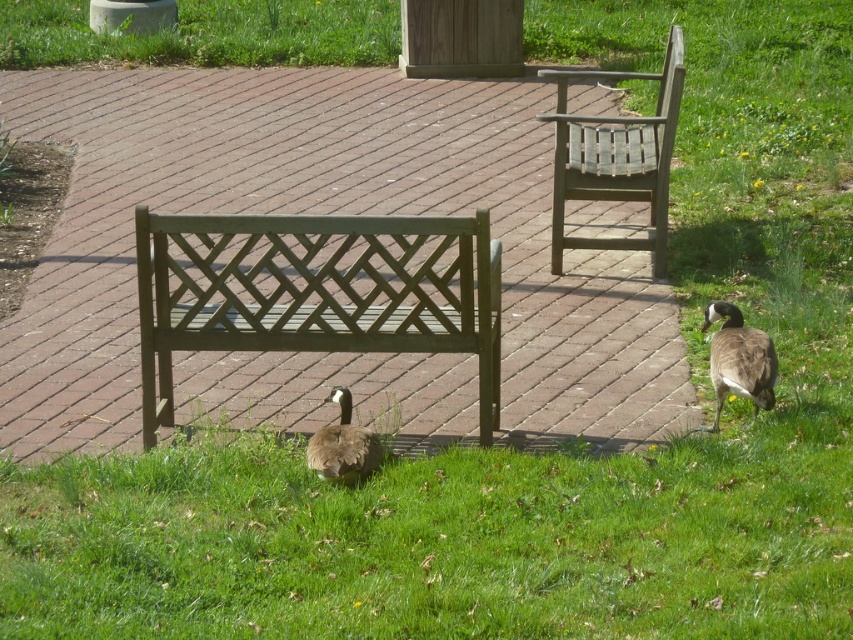
You are a photographer standing at the edge of the pathway. You want to take a photo that includes both the matte green bench at center and the brown matte duck at lower center. Based on their positions, which object should you adjust your camera angle to include first if you start from the left side of the frame?

The matte green bench at center is to the left of the brown matte duck at lower center, so you should adjust your camera angle to include the matte green bench at center first when starting from the left side of the frame.

You are planning to place a small potted plant between the matte green bench at center and the brown matte duck at lower center. Based on their sizes, which object should the plant be closer to?

The matte green bench at center is wider than the brown matte duck at lower center, so the plant should be placed closer to the brown matte duck at lower center to maintain balance.